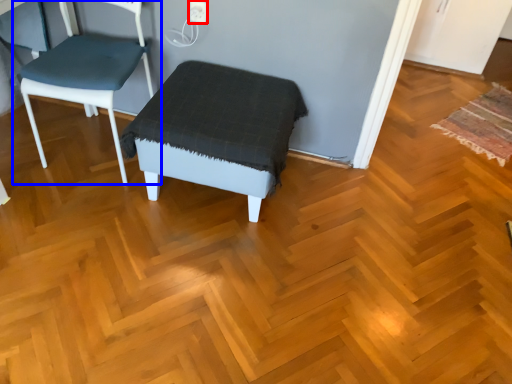
Question: Which object is closer to the camera taking this photo, electric outlet (highlighted by a red box) or chair (highlighted by a blue box)?

Choices:
 (A) electric outlet
 (B) chair

Answer: (B)